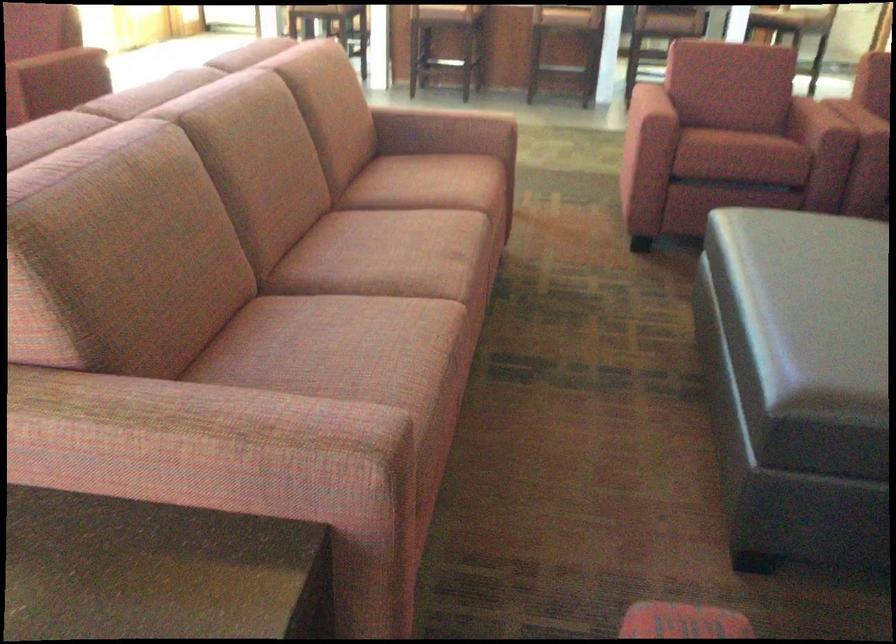
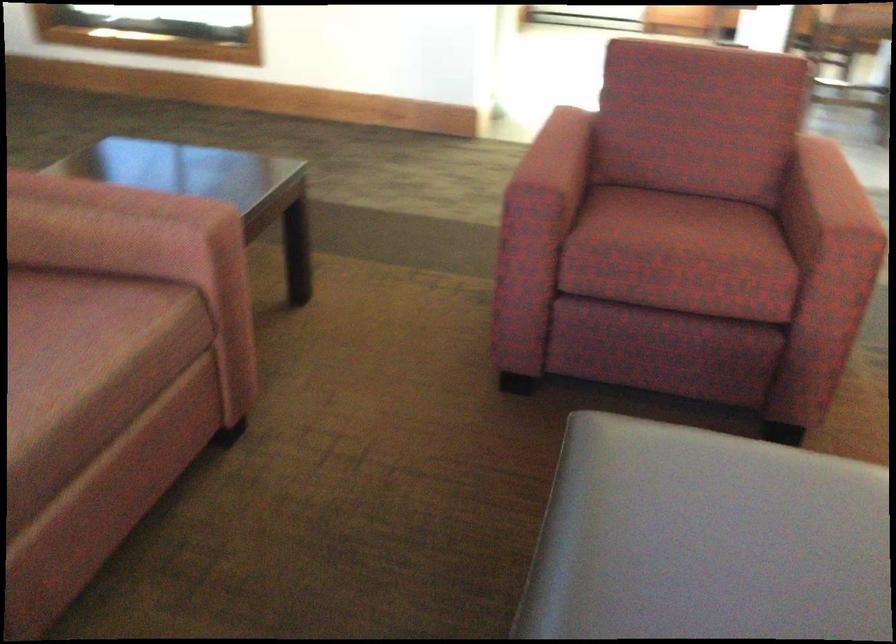
The images are taken continuously from a first-person perspective. In which direction are you moving?

The cameraman walked toward left, forward.